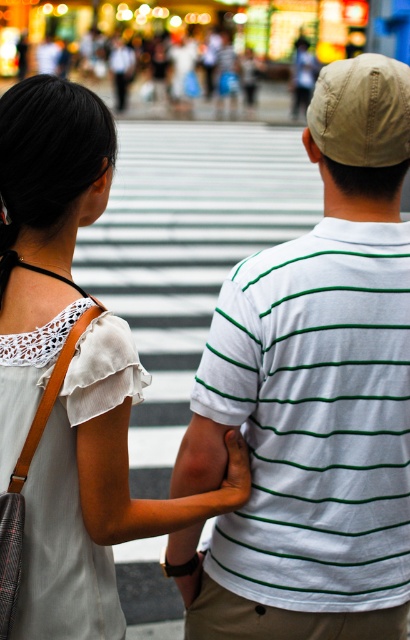
You are a photographer trying to capture a candid shot of the two people at the pedestrian crossing. You notice the white lace blouse at upper left and the orange smooth skin at lower center. Which object should you focus on first if you want to capture the subject closer to the foreground?

The orange smooth skin at lower center should be focused on first because it is closer to the foreground than the white lace blouse at upper left, which is located above it.

You are standing at the pedestrian crossing and want to take a photo of the point at coordinates (56, 554). If your camera has a focal length of 50mm and you are 6.41 feet away from the point, what is the required distance in feet between you and the camera to capture the point clearly?

The point at coordinates (56, 554) is 6.41 feet away from the camera. To capture it clearly, you should maintain that 6.41 feet distance between you and the camera.

Consider the image. You are a fashion designer observing two people at a pedestrian crossing. You notice the white striped shirt at center and the white lace blouse at upper left. Which clothing item has a greater width?

The white striped shirt at center has a greater width than the white lace blouse at upper left according to the description.